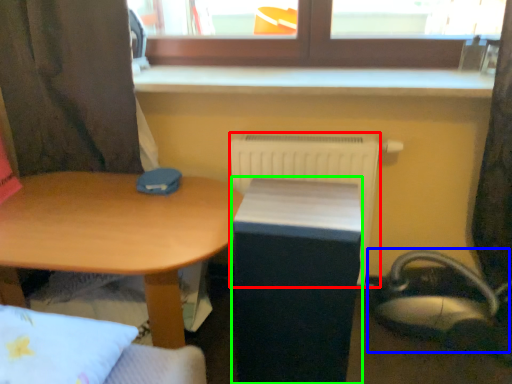
Question: Which object is the farthest from radiator (highlighted by a red box)? Choose among these: swivel chair (highlighted by a blue box) or changing table (highlighted by a green box).

Choices:
 (A) swivel chair
 (B) changing table

Answer: (A)